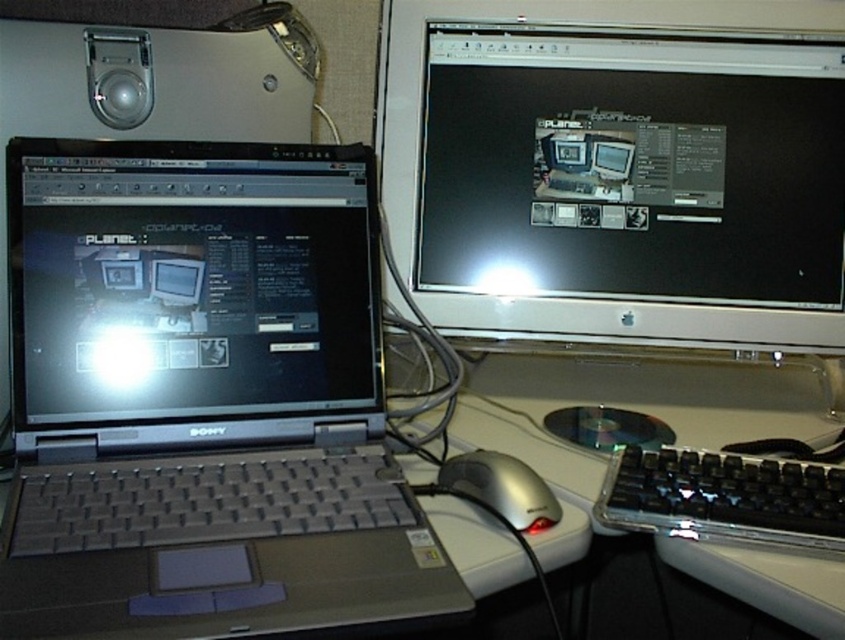
You are trying to locate the matte black laptop at left in the workspace. According to the coordinates provided, where exactly is it positioned?

The matte black laptop at left is positioned at point coordinates of 0.441 on the x axis and 0.226 on the y axis.

You are setting up a new monitor on the desk. The satin silver monitor at upper center and the white plastic computer desk at center are in the way. Which one is taller and needs to be moved first?

The satin silver monitor at upper center is much taller than the white plastic computer desk at center, so it needs to be moved first.

You are organizing cables for a workspace. You have a 10 inch long cable. You need to connect the matte black laptop at left to the white plastic computer desk at center. Is the cable long enough to reach between them?

The distance between the matte black laptop at left and the white plastic computer desk at center is 12.13 inches. Since the cable is only 10 inches long, it is too short to reach the required distance of 12.13 inches.